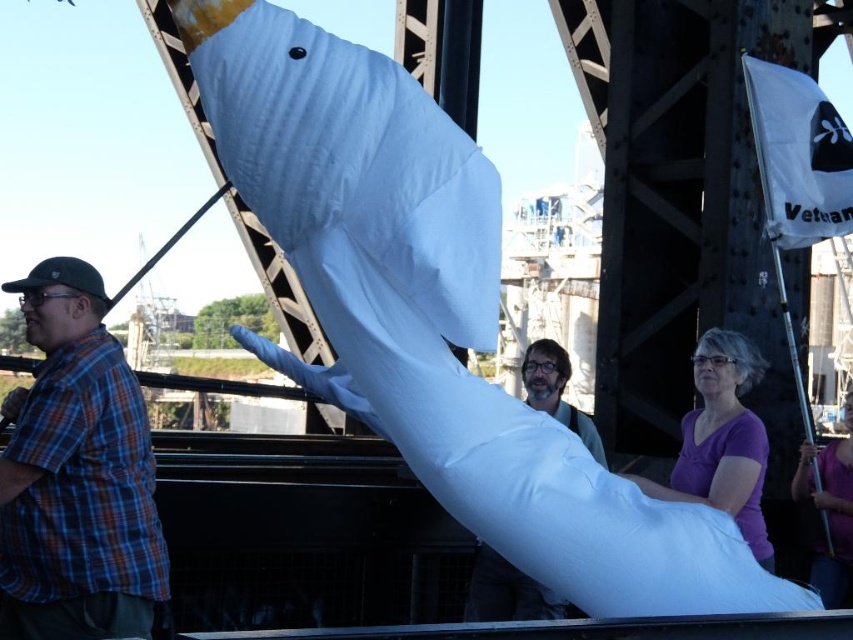
Question: Which object is closer to the camera taking this photo?

Choices:
 (A) purple matte shirt at lower right
 (B) plaid shirt at left
 (C) matte white pillow at center

Answer: (B)

Question: Which is farther from the purple matte shirt at lower right?

Choices:
 (A) purple matte shirt at center
 (B) plaid shirt at left

Answer: (B)

Question: Among these objects, which one is nearest to the camera?

Choices:
 (A) plaid shirt at left
 (B) purple matte shirt at lower right
 (C) matte white pillow at center
 (D) purple matte shirt at center

Answer: (A)

Question: Can you confirm if purple matte shirt at center is positioned to the left of matte white pillow at center?

Choices:
 (A) yes
 (B) no

Answer: (B)

Question: Is purple matte shirt at center to the right of matte white pillow at center from the viewer's perspective?

Choices:
 (A) yes
 (B) no

Answer: (A)

Question: Is plaid shirt at left to the left of purple matte shirt at lower right from the viewer's perspective?

Choices:
 (A) yes
 (B) no

Answer: (A)